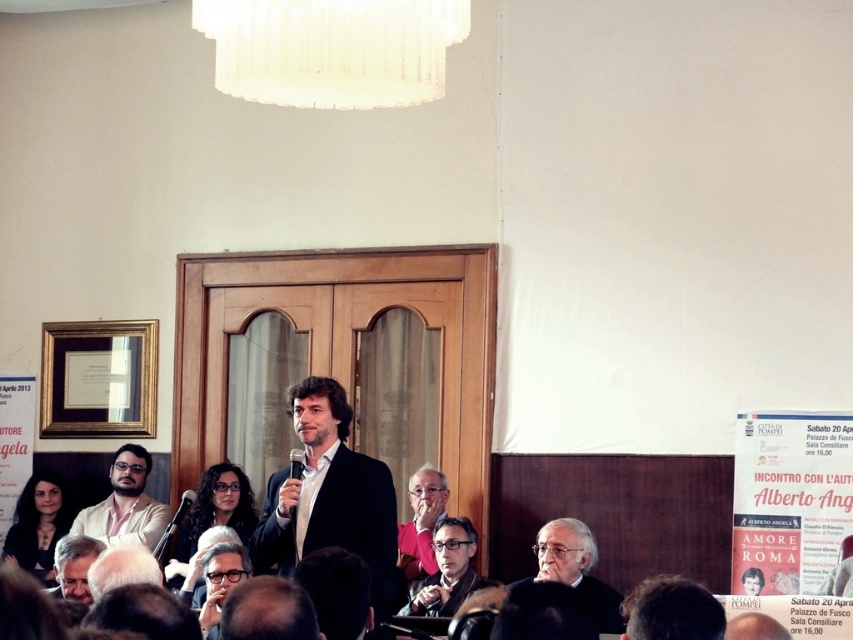
Does black textured suit at lower right appear on the right side of gray hair at lower left?

Correct, you'll find black textured suit at lower right to the right of gray hair at lower left.

Is black textured suit at lower right positioned behind gray hair at lower left?

Yes, black textured suit at lower right is behind gray hair at lower left.

Does point (561, 541) come in front of point (90, 595)?

No, it is behind (90, 595).

The width and height of the screenshot is (853, 640). In order to click on black textured suit at lower right in this screenshot , I will do `click(575, 566)`.

Does point (169, 506) come in front of point (177, 545)?

No, (169, 506) is behind (177, 545).

Between matte white shirt at lower left and matte black glasses at center, which one is positioned lower?

matte black glasses at center is below.

Which is behind, point (132, 456) or point (245, 481)?

The point (132, 456) is behind.

Where is `matte white shirt at lower left`? matte white shirt at lower left is located at coordinates (125, 502).

Which is in front, point (286, 570) or point (44, 513)?

Positioned in front is point (286, 570).

Does matte black suit at center have a greater width compared to dark hair at lower left?

Indeed, matte black suit at center has a greater width compared to dark hair at lower left.

Measure the distance between matte black suit at center and camera.

The distance of matte black suit at center from camera is 9.70 meters.

Where is `matte black suit at center`? This screenshot has height=640, width=853. matte black suit at center is located at coordinates (329, 497).